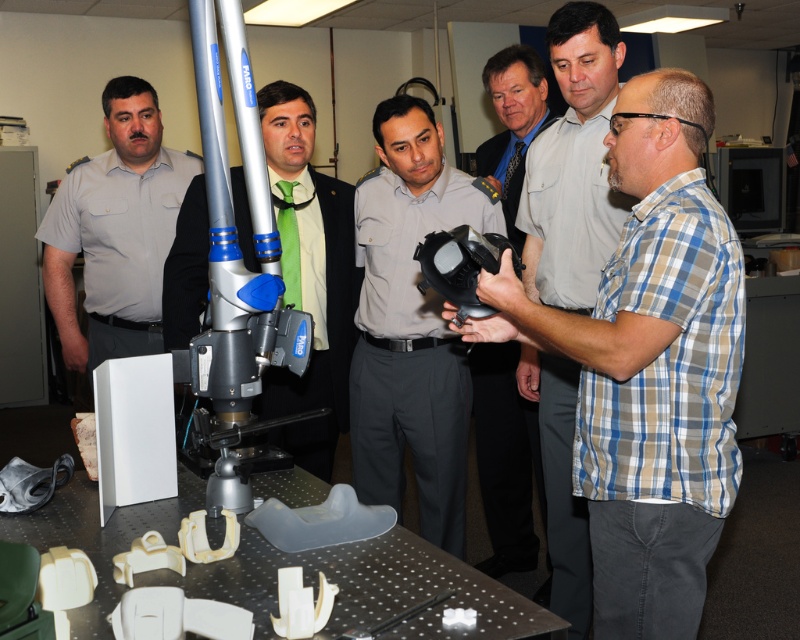
Who is positioned more to the right, matte gray helmet at center or gray uniform at left?

Positioned to the right is matte gray helmet at center.

The image size is (800, 640). Identify the location of matte gray helmet at center. (410, 324).

In order to click on matte gray helmet at center in this screenshot , I will do `click(410, 324)`.

Is plaid cotton shirt at center smaller than matte black helmet at center?

Actually, plaid cotton shirt at center might be larger than matte black helmet at center.

Does plaid cotton shirt at center appear under matte black helmet at center?

Correct, plaid cotton shirt at center is located below matte black helmet at center.

Locate an element on the screen. plaid cotton shirt at center is located at coordinates (574, 164).

Is gray uniform at left above black matte mask at center?

Yes, gray uniform at left is above black matte mask at center.

From the picture: Which is more to the left, gray uniform at left or black matte mask at center?

Positioned to the left is gray uniform at left.

Who is more distant from viewer, (x=132, y=129) or (x=462, y=285)?

Point (x=132, y=129)

Image resolution: width=800 pixels, height=640 pixels. I want to click on gray uniform at left, so click(114, 230).